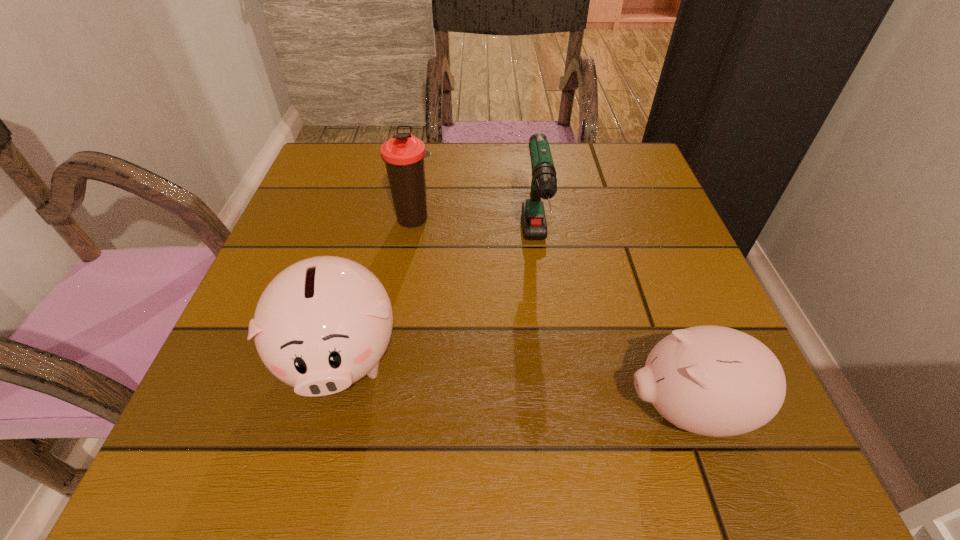
Image resolution: width=960 pixels, height=540 pixels. I want to click on vacant region that satisfies the following two spatial constraints: 1. on the back side of the thermos bottle; 2. on the right side of the taller piggy bank, so click(x=377, y=219).